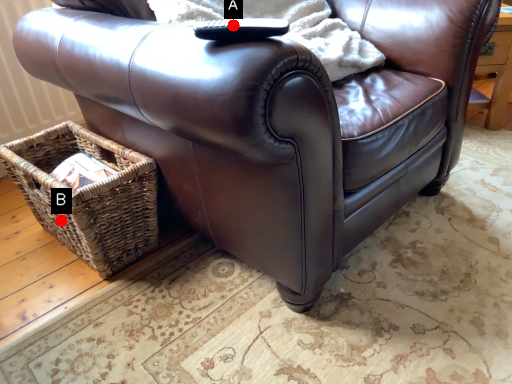
Question: Two points are circled on the image, labeled by A and B beside each circle. Which point is farther from the camera taking this photo?

Choices:
 (A) A is further
 (B) B is further

Answer: (B)